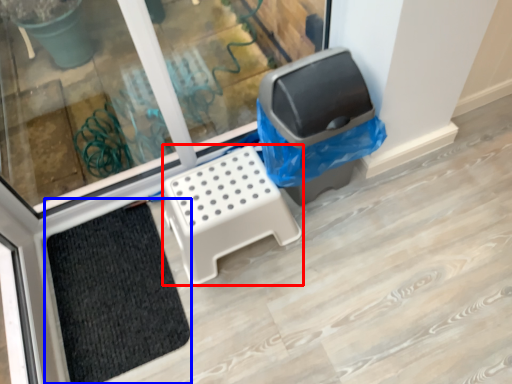
Question: Which object appears farthest to the camera in this image, furniture (highlighted by a red box) or doormat (highlighted by a blue box)?

Choices:
 (A) furniture
 (B) doormat

Answer: (B)